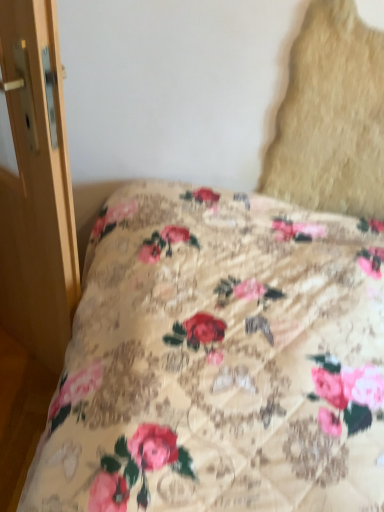
Question: From the image's perspective, does beige textured pillow at upper right appear higher than wooden door at left?

Choices:
 (A) yes
 (B) no

Answer: (A)

Question: Can you confirm if beige textured pillow at upper right is thinner than wooden door at left?

Choices:
 (A) yes
 (B) no

Answer: (A)

Question: Does beige textured pillow at upper right turn towards wooden door at left?

Choices:
 (A) no
 (B) yes

Answer: (A)

Question: Can you confirm if beige textured pillow at upper right is wider than wooden door at left?

Choices:
 (A) no
 (B) yes

Answer: (A)

Question: Is beige textured pillow at upper right with wooden door at left?

Choices:
 (A) no
 (B) yes

Answer: (A)

Question: From a real-world perspective, is beige textured pillow at upper right positioned under wooden door at left based on gravity?

Choices:
 (A) no
 (B) yes

Answer: (A)

Question: Is wooden door at left positioned with its back to beige textured pillow at upper right?

Choices:
 (A) yes
 (B) no

Answer: (B)

Question: Is wooden door at left positioned beyond the bounds of beige textured pillow at upper right?

Choices:
 (A) yes
 (B) no

Answer: (A)

Question: Is wooden door at left at the right side of beige textured pillow at upper right?

Choices:
 (A) no
 (B) yes

Answer: (A)

Question: Is wooden door at left wider than beige textured pillow at upper right?

Choices:
 (A) no
 (B) yes

Answer: (B)

Question: From a real-world perspective, does wooden door at left stand above beige textured pillow at upper right?

Choices:
 (A) no
 (B) yes

Answer: (A)

Question: Can you confirm if wooden door at left is smaller than beige textured pillow at upper right?

Choices:
 (A) yes
 (B) no

Answer: (B)

Question: From the image's perspective, is wooden door at left located above or below beige textured pillow at upper right?

Choices:
 (A) above
 (B) below

Answer: (B)